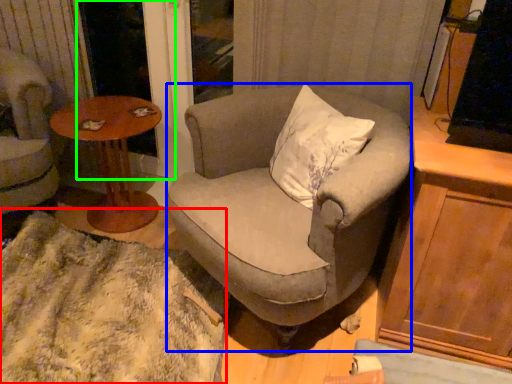
Question: Which is farther away from blanket (highlighted by a red box)? chair (highlighted by a blue box) or screen door (highlighted by a green box)?

Choices:
 (A) chair
 (B) screen door

Answer: (B)